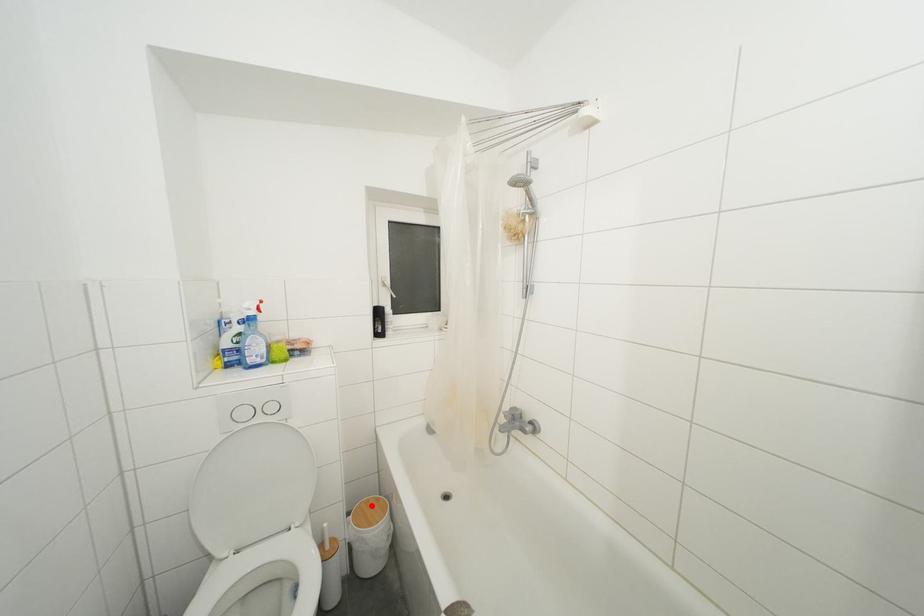
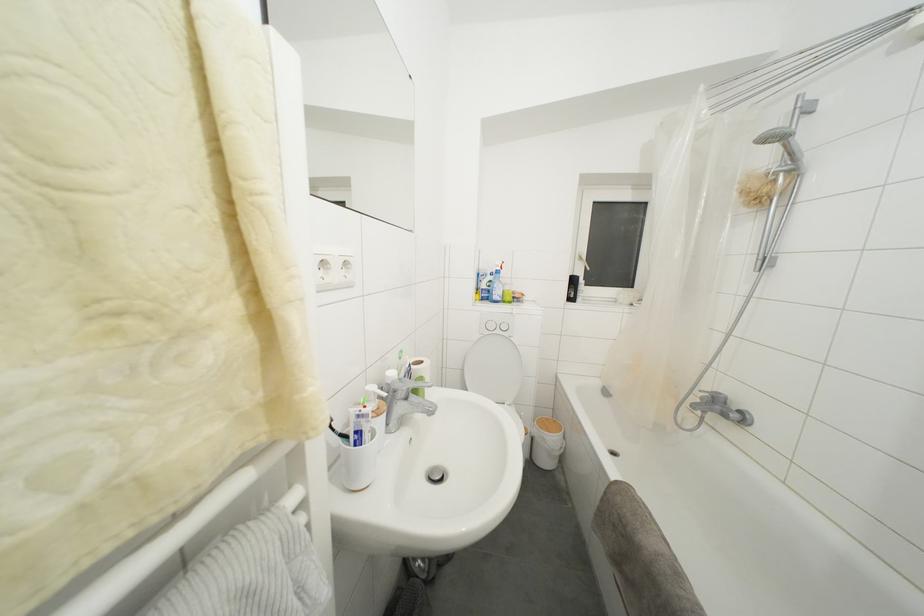
Question: I am providing you with two images of the same scene from different viewpoints. Image1 has a red point marked. In image2, the corresponding 3D location appears at what relative position? Reply with the corresponding letter.

Choices:
 (A) Closer
 (B) Farther

Answer: (B)